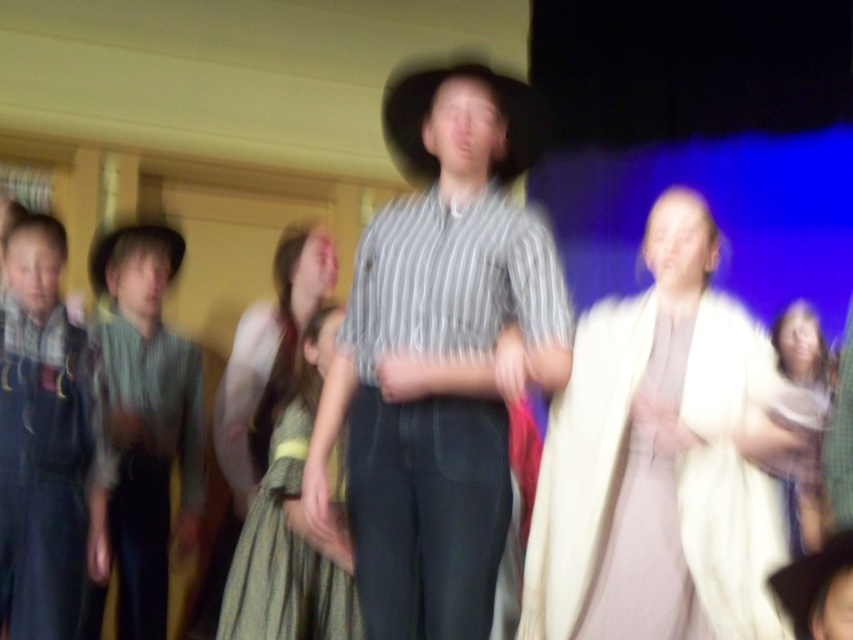
Based on the coordinates provided in the image, which object is located at point (x=439, y=355)?

The point (x=439, y=355) corresponds to the striped cotton shirt at center.

Based on the scene description, which object is wider, the light beige fabric dress at center or the striped fabric shirt at left?

The light beige fabric dress at center might be wider than striped fabric shirt at left according to the description.